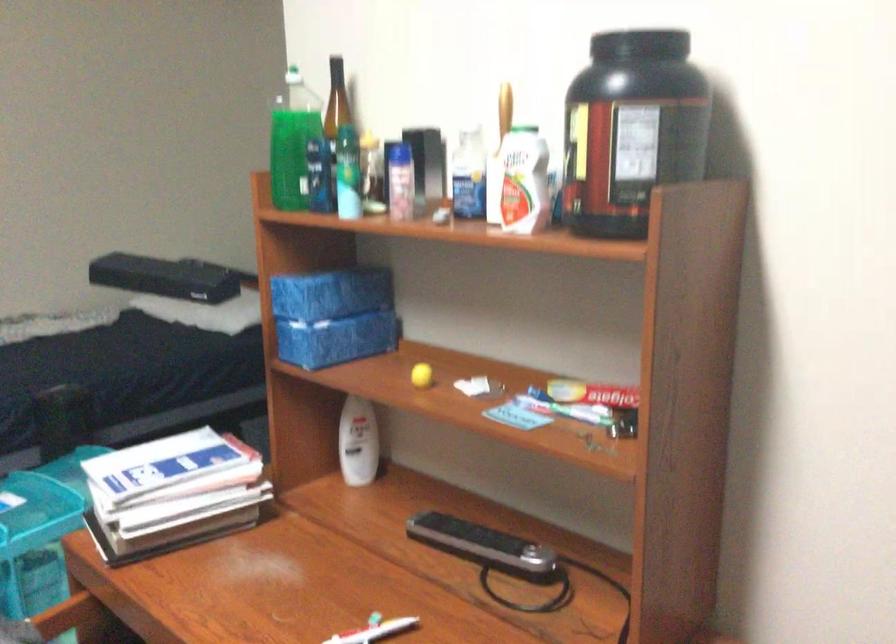
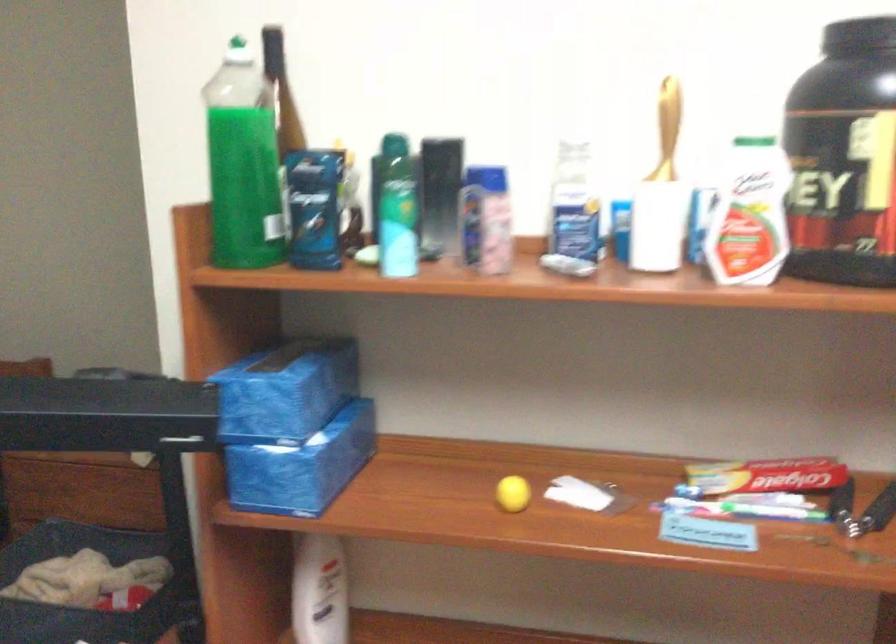
Locate, in the second image, the point that corresponds to (419,373) in the first image.

(513, 494)